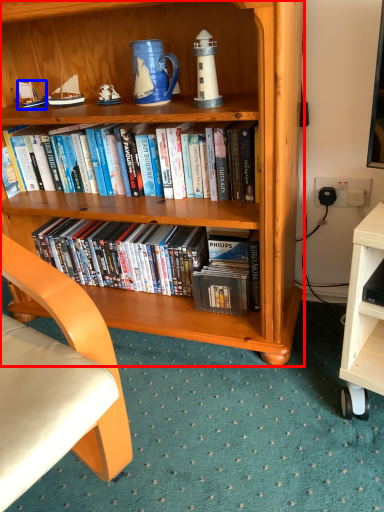
Question: Among these objects, which one is nearest to the camera, bookcase (highlighted by a red box) or sailboat (highlighted by a blue box)?

Choices:
 (A) bookcase
 (B) sailboat

Answer: (A)